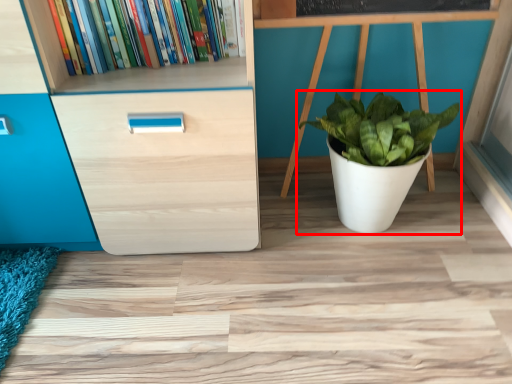
Question: From the image's perspective, where is houseplant (annotated by the red box) located in relation to book in the image?

Choices:
 (A) above
 (B) below

Answer: (B)